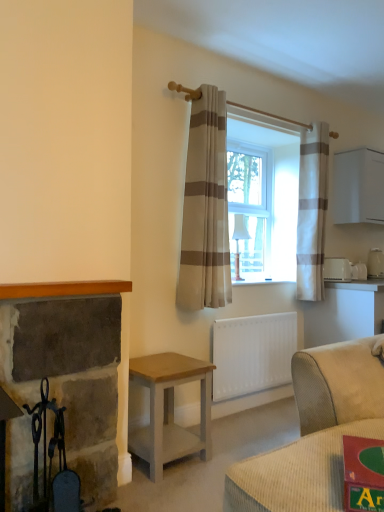
At what (x,y) coordinates should I click in order to perform the action: click on free point above white matte radiator at lower center (from a real-world perspective). Please return your answer as a coordinate pair (x, y). This screenshot has width=384, height=512. Looking at the image, I should click on (254, 314).